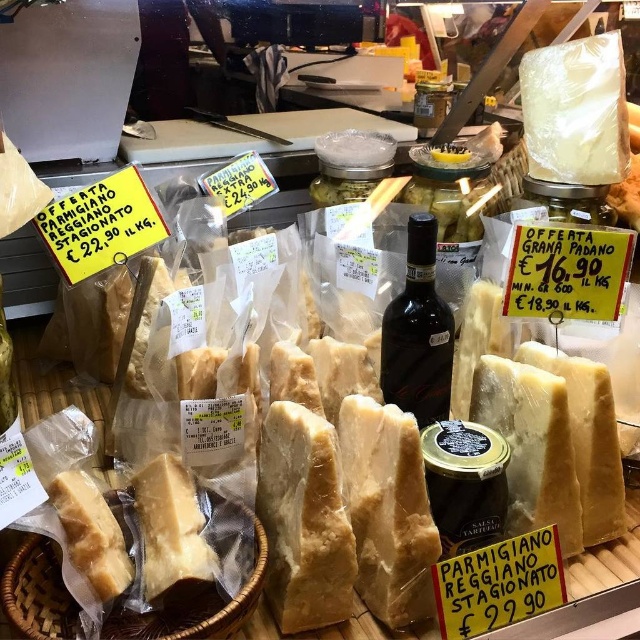
Does translucent plastic bag at lower left appear on the left side of dark glass bottle at center?

Indeed, translucent plastic bag at lower left is positioned on the left side of dark glass bottle at center.

Is translucent plastic bag at lower left to the right of dark glass bottle at center from the viewer's perspective?

In fact, translucent plastic bag at lower left is to the left of dark glass bottle at center.

Where is `translucent plastic bag at lower left`? This screenshot has width=640, height=640. translucent plastic bag at lower left is located at coordinates (36, 593).